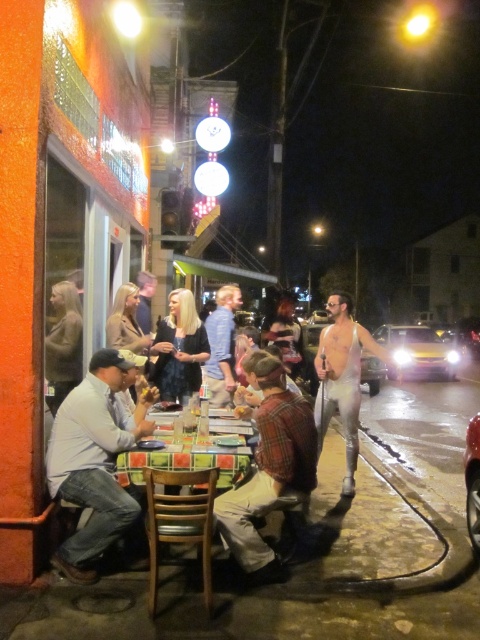
Is plaid shirt at center further to camera compared to plaid fabric table at center?

Yes, plaid shirt at center is further from the viewer.

How far apart are plaid shirt at center and plaid fabric table at center?

plaid shirt at center is 15.10 inches away from plaid fabric table at center.

Between point (216, 520) and point (204, 456), which one is positioned behind?

The point (216, 520) is more distant.

Where is `plaid shirt at center`? The height and width of the screenshot is (640, 480). plaid shirt at center is located at coordinates (269, 468).

At what (x,y) coordinates should I click in order to perform the action: click on silver metallic suit at right. Please return your answer as a coordinate pair (x, y). Looking at the image, I should click on (343, 378).

Does silver metallic suit at right have a smaller size compared to blue cotton shirt at center?

Incorrect, silver metallic suit at right is not smaller in size than blue cotton shirt at center.

Where is `silver metallic suit at right`? silver metallic suit at right is located at coordinates (343, 378).

Describe the element at coordinates (96, 460) in the screenshot. This screenshot has width=480, height=640. I see `light blue shirt at lower left` at that location.

From the picture: Does light blue shirt at lower left appear on the left side of light brown leather jacket at left?

No, light blue shirt at lower left is not to the left of light brown leather jacket at left.

This screenshot has height=640, width=480. Describe the element at coordinates (96, 460) in the screenshot. I see `light blue shirt at lower left` at that location.

The height and width of the screenshot is (640, 480). I want to click on light blue shirt at lower left, so click(x=96, y=460).